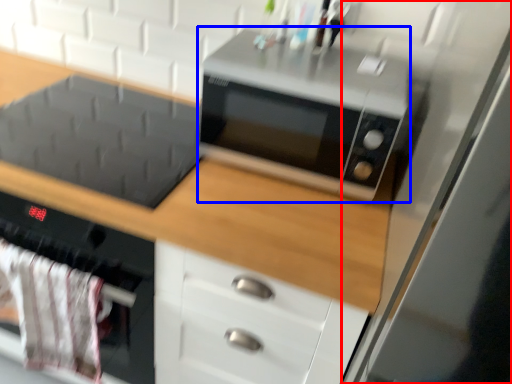
Question: Which object appears closest to the camera in this image, glass door (highlighted by a red box) or microwave oven (highlighted by a blue box)?

Choices:
 (A) glass door
 (B) microwave oven

Answer: (A)